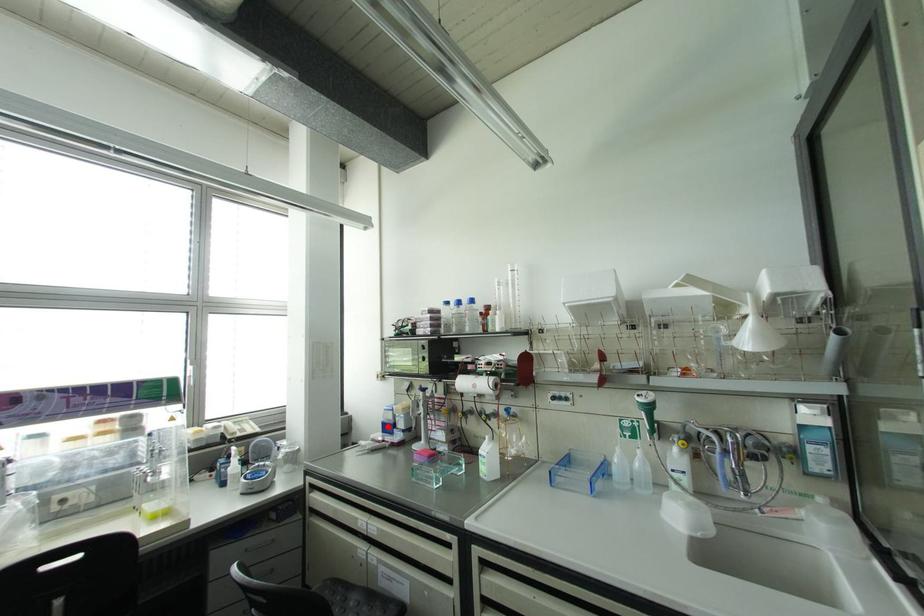
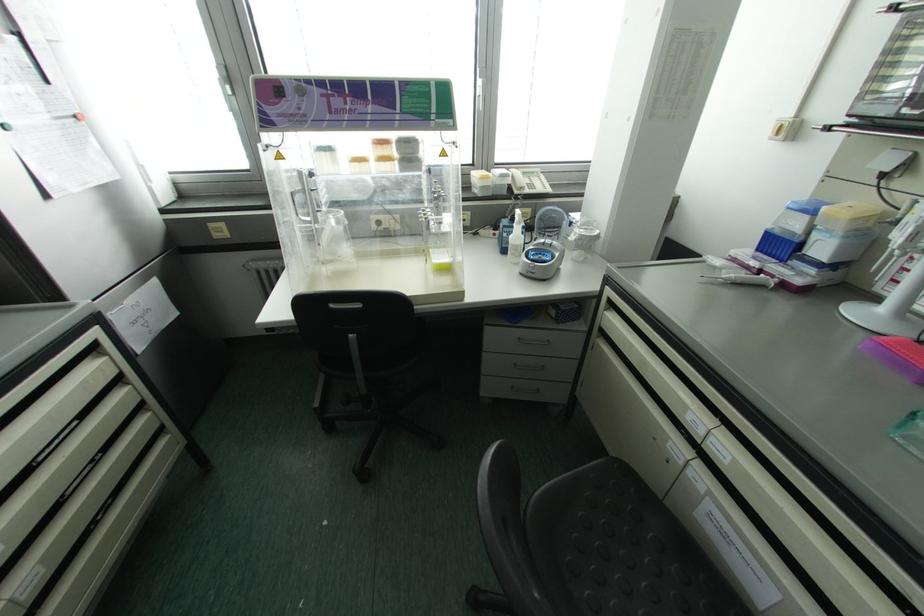
Question: I am providing you with two images of the same scene from different viewpoints. A red point is marked on the first image. At the location where the point appears in image 1, is it still visible in image 2?

Choices:
 (A) Yes
 (B) No

Answer: (A)